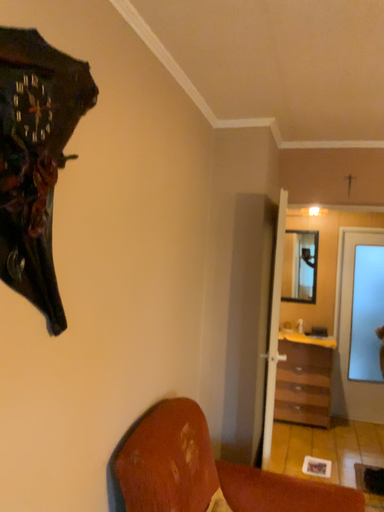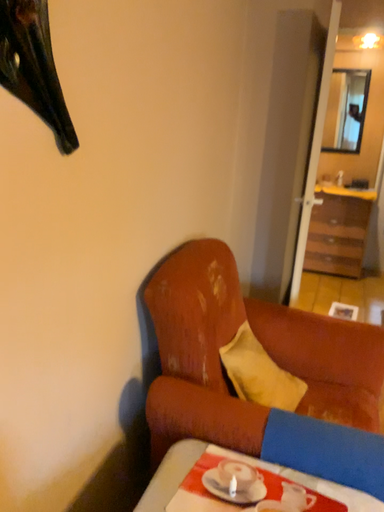
Question: How did the camera likely rotate when shooting the video?

Choices:
 (A) rotated upward
 (B) rotated downward

Answer: (B)